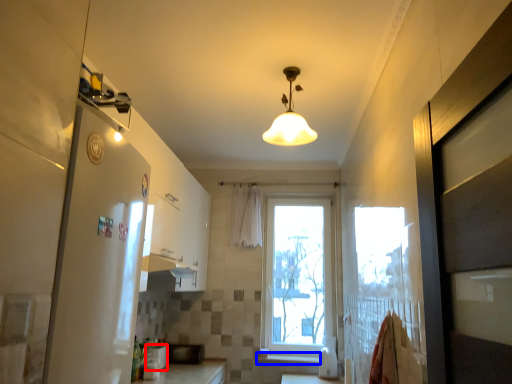
Question: Which object is closer to the camera taking this photo, appliance (highlighted by a red box) or window sill (highlighted by a blue box)?

Choices:
 (A) appliance
 (B) window sill

Answer: (A)